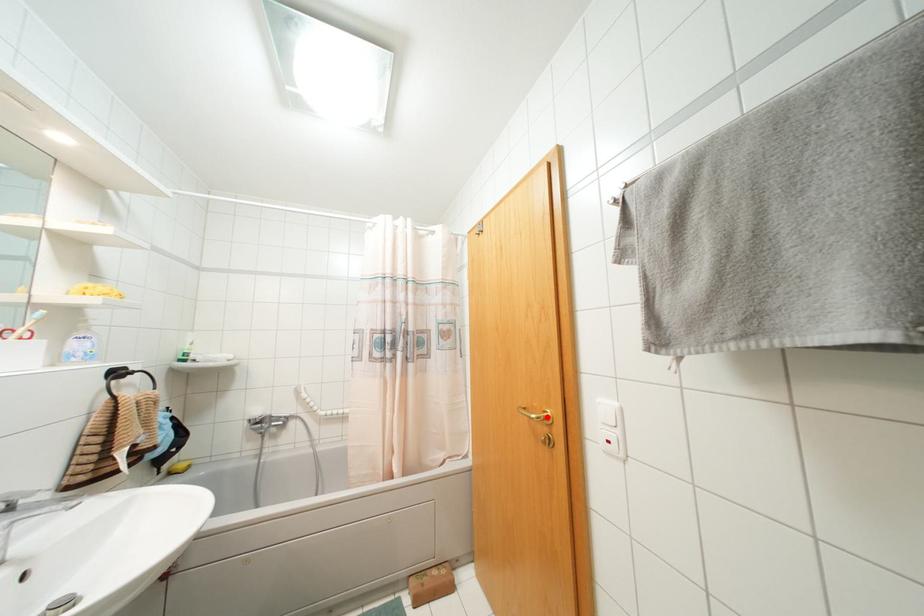
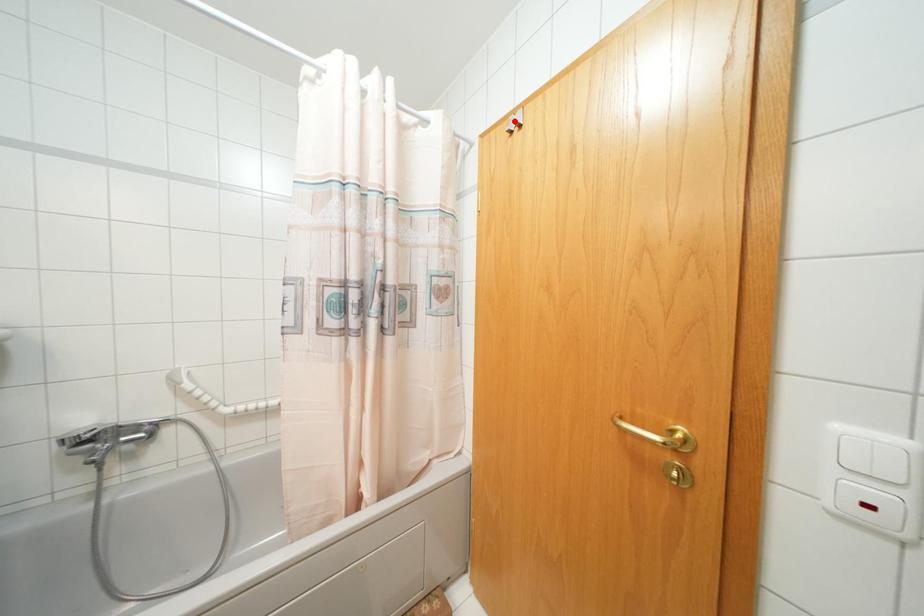
I am providing you with two images of the same scene from different viewpoints. A red point is marked on the first image and another point is marked on the second image. Is the red point in image1 aligned with the point shown in image2?

No